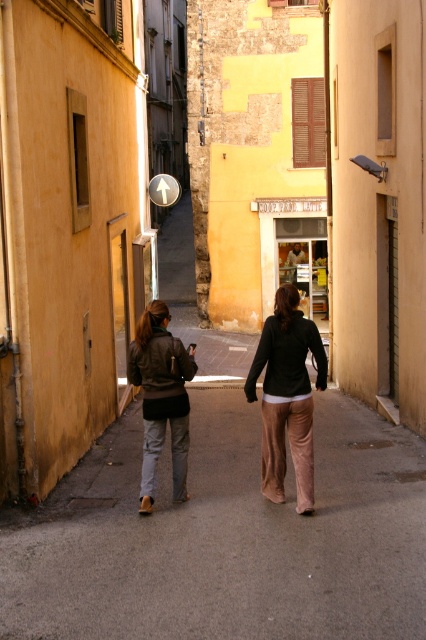
You are navigating a narrow alleyway and need to place two markers at the coordinates provided. The first marker is at point (253,580) and the second at point (273,467). If you are facing the direction of the street sign with the white arrow pointing upwards, which marker is closer to you?

Point (253,580) is in front of point (273,467), so the first marker at point (253,580) is closer to you.

You are a delivery person carrying a box that is 1.2 meters wide. You need to pass through the alleyway where there are two jackets hanging at the center. Can your box fit between the leather jacket at center and matte brown jacket at center?

The leather jacket at center might be wider than matte brown jacket at center, so the combined width of both jackets could exceed the alleyway space. The box that is 1.2 meters wide may not fit between them. Check the actual width before proceeding.

You are standing in the alleyway and see a point marked at coordinates (287,396). According to the scene description, what object is located at that point?

The point at (287,396) is on the leather jacket at center.